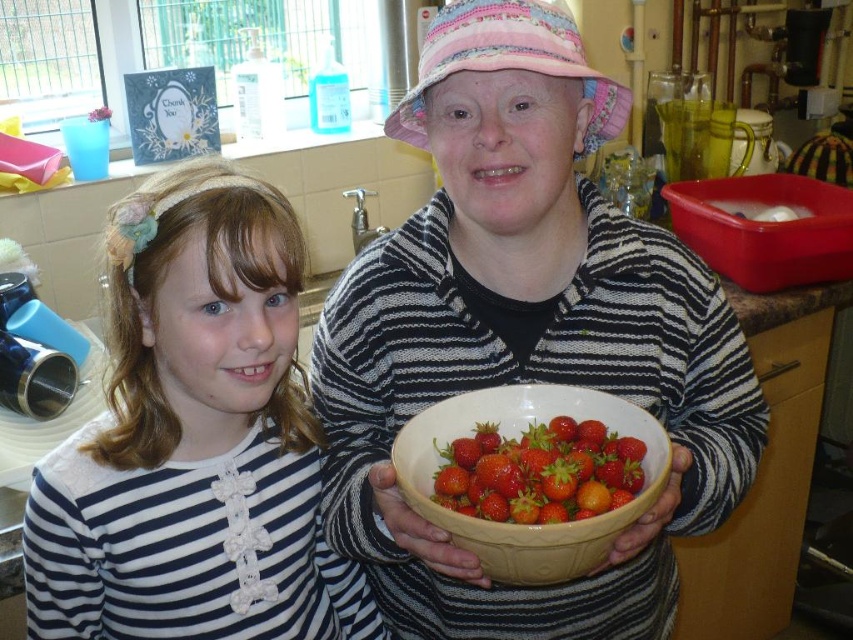
What is the 2D coordinate of the white striped shirt at center in the image?

The white striped shirt at center is located at the 2D coordinate point of [194,440].

You are standing in the kitchen and see the point marked at coordinates (517, 438). What object is located at that point?

The point at coordinates (517, 438) indicates the white ceramic bowl at center.

You are standing in the kitchen and see the image. There is a matte ceramic bowl at center located at point (524, 332). Can you tell me where the bowl is in relation to the two people?

The matte ceramic bowl at center is located at point (524, 332), which is the center of the image. Since both people are positioned to the sides, the bowl is centrally placed between them.